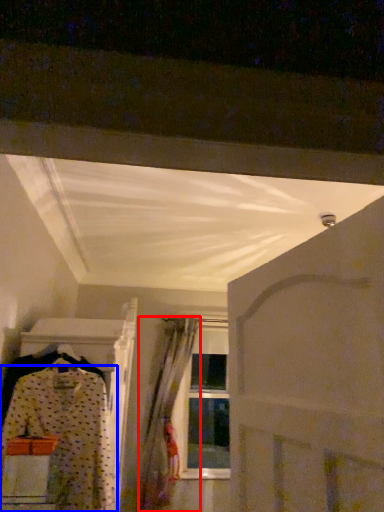
Question: Which of the following is the farthest to the observer, curtain (highlighted by a red box) or fancy dress (highlighted by a blue box)?

Choices:
 (A) curtain
 (B) fancy dress

Answer: (A)